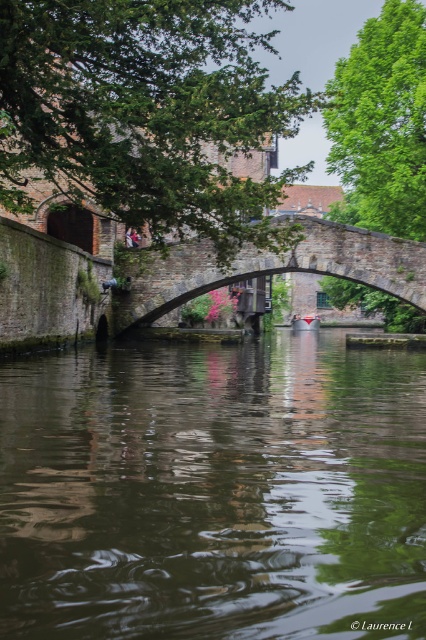
You are a tour guide explaining the canal to visitors. You mention both the stone arch bridge at center and the matte red boat at center. Which of these two objects is wider?

The stone arch bridge at center is wider than the matte red boat at center.

You are a tourist standing on the cobblestone bridge in the canal scene. You notice the green reflective water at center and the matte red boat at center. Which object occupies more space in the image?

The green reflective water at center occupies more space in the image than the matte red boat at center, as it is described as bigger.

You are a tour guide explaining the canal scene to visitors. You mention both the green reflective water at center and the matte red boat at center. Which one do you think is wider?

The green reflective water at center is wider than the matte red boat at center.